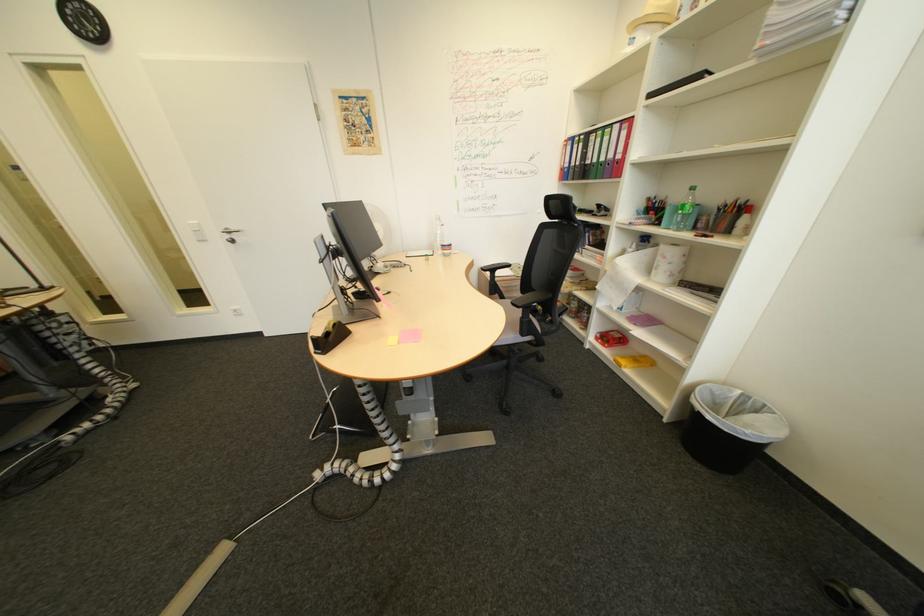
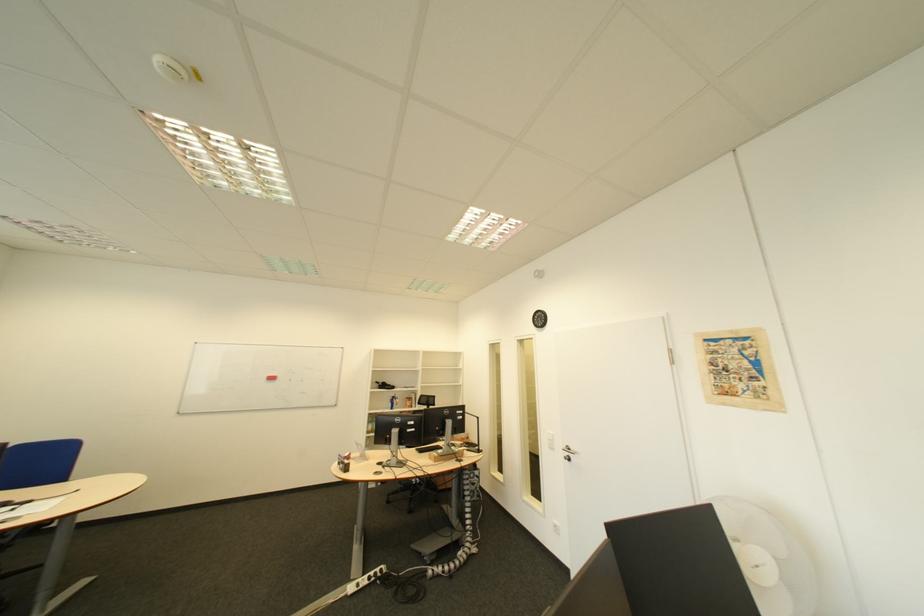
Question: I am providing you with two images of the same scene from different viewpoints. Which of the following objects are not visible in image2?

Choices:
 (A) black telephone handset
 (B) red whiteboard eraser
 (C) blue and silver can
 (D) none of these

Answer: (D)